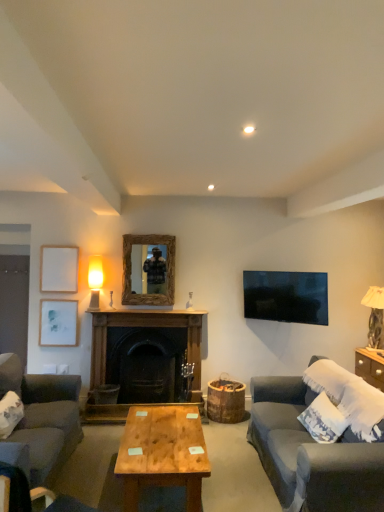
Question: From a real-world perspective, is marble-like beige table lamp at right, which appears as the 2th table lamp when viewed from the left, positioned above or below white textured pillow at right?

Choices:
 (A) below
 (B) above

Answer: (B)

Question: From the image's perspective, relative to white textured pillow at right, is marble-like beige table lamp at right, which appears as the 2th table lamp when viewed from the left, above or below?

Choices:
 (A) below
 (B) above

Answer: (B)

Question: Based on their relative distances, which object is farther from the dark wood fireplace at center?

Choices:
 (A) wooden-framed mirror at center
 (B) white matte picture frame at upper left, marked as the 2th picture frame in a top-to-bottom arrangement
 (C) dark gray fabric couch at lower right, the second studio couch positioned from the left
 (D) dark gray fabric chair at lower left
 (E) marble-like beige table lamp at right, which appears as the 2th table lamp when viewed from the left

Answer: (D)

Question: Considering the real-world distances, which object is farthest from the white matte picture frame at upper left, positioned as the first picture frame in bottom-to-top order?

Choices:
 (A) white matte picture frame at upper left, which is counted as the 2th picture frame, starting from the bottom
 (B) wooden-framed mirror at center
 (C) dark gray fabric couch at lower right, which is counted as the second studio couch, starting from the back
 (D) dark gray fabric couch at lower left, which is the 1th studio couch from left to right
 (E) white textured pillow at right

Answer: (E)